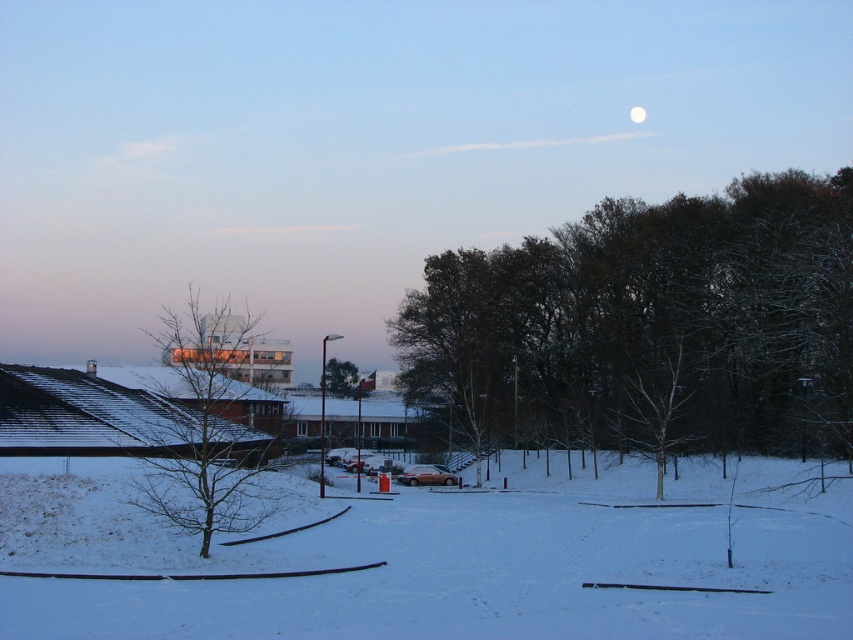
Question: Among these points, which one is farthest from the camera?

Choices:
 (A) (x=798, y=256)
 (B) (x=242, y=456)

Answer: (A)

Question: Is white powdery snow at center further to the viewer compared to white glossy moon at upper center?

Choices:
 (A) yes
 (B) no

Answer: (B)

Question: Among these objects, which one is nearest to the camera?

Choices:
 (A) white glossy moon at upper center
 (B) bare branches at left
 (C) white powdery snow at center

Answer: (C)

Question: Which point is closer to the camera?

Choices:
 (A) (337, 387)
 (B) (692, 529)

Answer: (B)

Question: Is white powdery snow at center thinner than bare branches at left?

Choices:
 (A) yes
 (B) no

Answer: (A)

Question: Can you confirm if dark brown textured tree at center is smaller than white glossy moon at upper center?

Choices:
 (A) yes
 (B) no

Answer: (B)